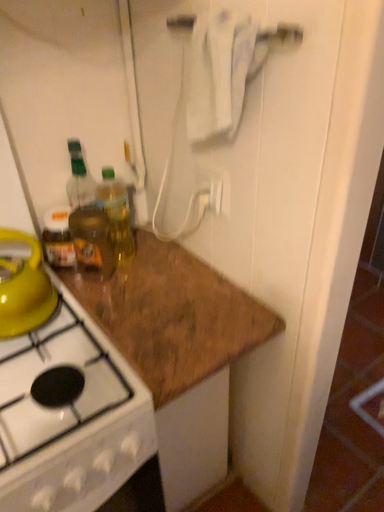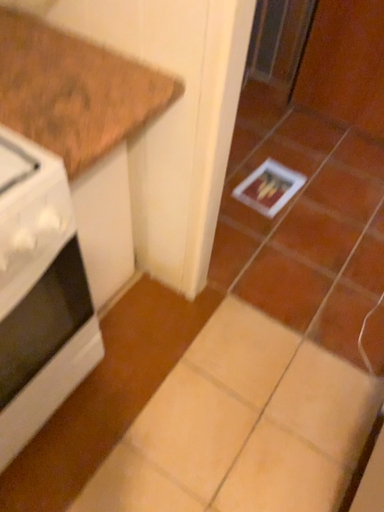
Question: How did the camera likely rotate when shooting the video?

Choices:
 (A) rotated left
 (B) rotated right

Answer: (B)